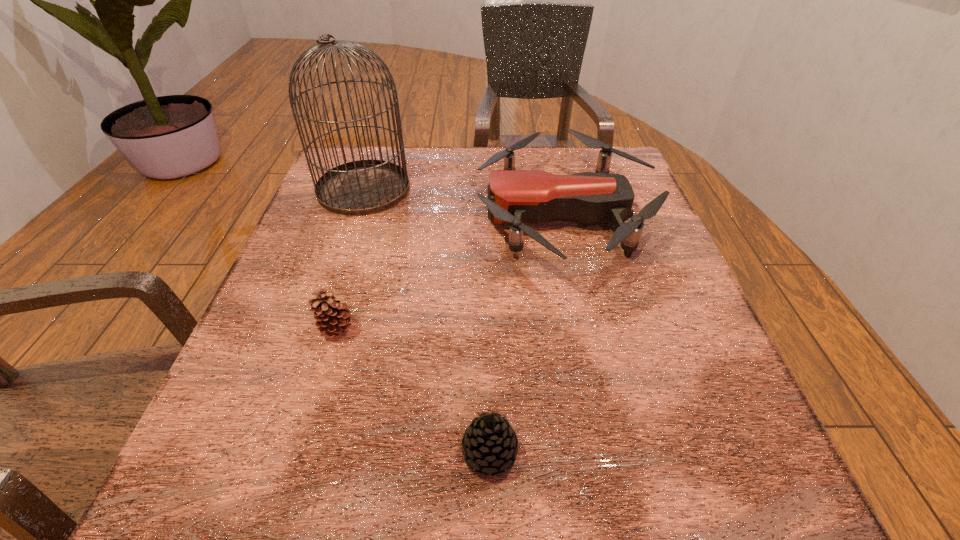
Identify the location of the tallest object. This screenshot has width=960, height=540. (363, 187).

This screenshot has height=540, width=960. What are the coordinates of `drone` in the screenshot? It's located at (517, 197).

The image size is (960, 540). I want to click on the second nearest object, so click(332, 317).

Where is `the left pinecone`? This screenshot has height=540, width=960. the left pinecone is located at coordinates (332, 317).

You are a GUI agent. You are given a task and a screenshot of the screen. Output one action in this format:
    pyautogui.click(x=<x>, y=<y>)
    Task: Click on the shorter pinecone
    This screenshot has width=960, height=540.
    Given the screenshot: What is the action you would take?
    pyautogui.click(x=489, y=444)

Find the location of a particular element. The image size is (960, 540). the nearest object is located at coordinates (x=489, y=444).

Identify the location of vacant space situated 0.300m on the right of the birdcage. This screenshot has width=960, height=540. (538, 189).

Where is `vacant area situated on the front-facing side of the drone`? vacant area situated on the front-facing side of the drone is located at coordinates (344, 215).

Locate an element on the screen. The image size is (960, 540). vacant area located 0.140m on the front-facing side of the drone is located at coordinates (413, 215).

The image size is (960, 540). I want to click on vacant point located 0.090m on the front-facing side of the drone, so click(x=436, y=215).